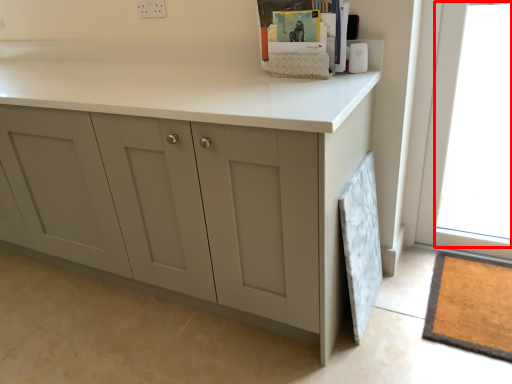
Question: Considering the relative positions of window (annotated by the red box) and cabinetry in the image provided, where is window (annotated by the red box) located with respect to the staircase?

Choices:
 (A) left
 (B) right

Answer: (B)